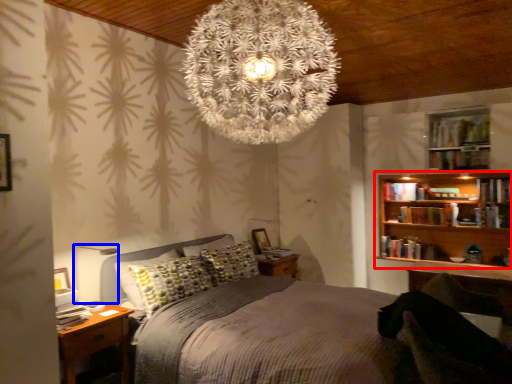
Question: Among these objects, which one is farthest to the camera, bookcase (highlighted by a red box) or table lamp (highlighted by a blue box)?

Choices:
 (A) bookcase
 (B) table lamp

Answer: (A)